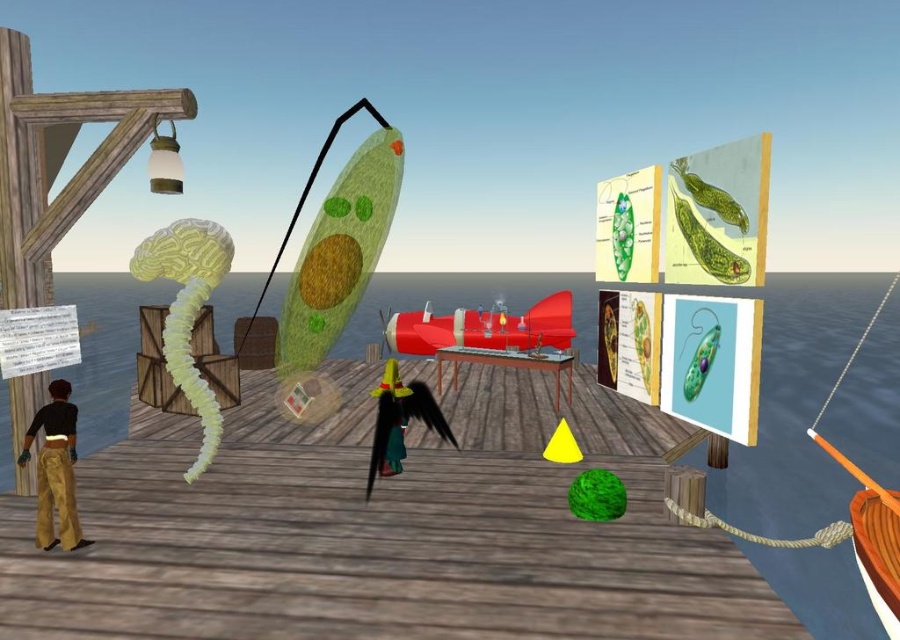
You are an observer standing on the wooden deck looking at the scene. You see the transparent water at center and the wooden table at center. Which object is closer to you?

The transparent water at center is closer to you because it is in front of the wooden table at center.